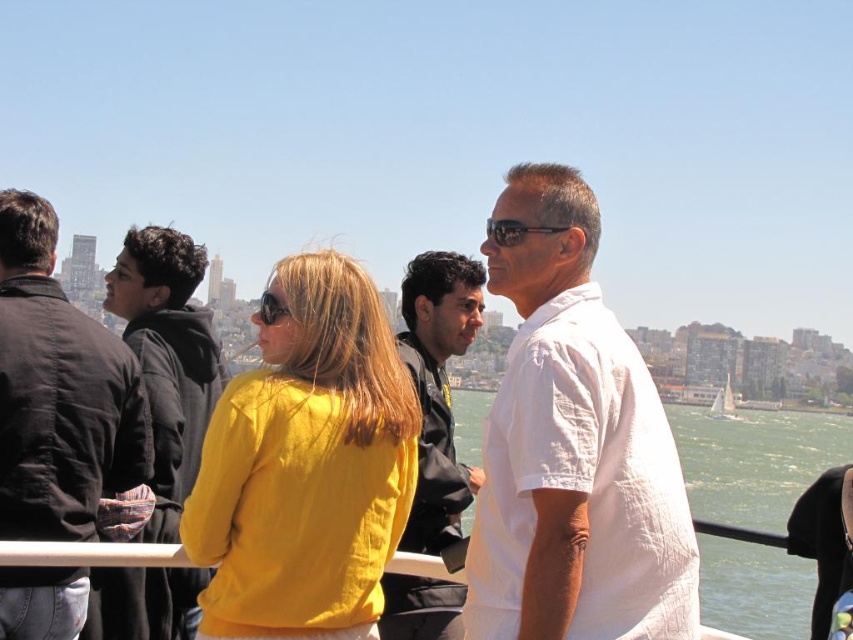
Between point (13, 444) and point (758, 458), which one is positioned behind?

Point (758, 458)

Looking at this image, between dark brown leather jacket at left and clear water at right, which one is positioned lower?

clear water at right is below.

Identify the location of dark brown leather jacket at left. (57, 392).

Who is more distant from viewer, (721, 525) or (222, 369)?

The point (222, 369) is more distant.

The height and width of the screenshot is (640, 853). What do you see at coordinates (753, 509) in the screenshot?
I see `clear water at right` at bounding box center [753, 509].

Locate an element on the screen. clear water at right is located at coordinates (753, 509).

Is the position of clear water at right more distant than that of white sailboat at right?

No.

Which is above, clear water at right or white sailboat at right?

Positioned higher is white sailboat at right.

Locate an element on the screen. clear water at right is located at coordinates pos(753,509).